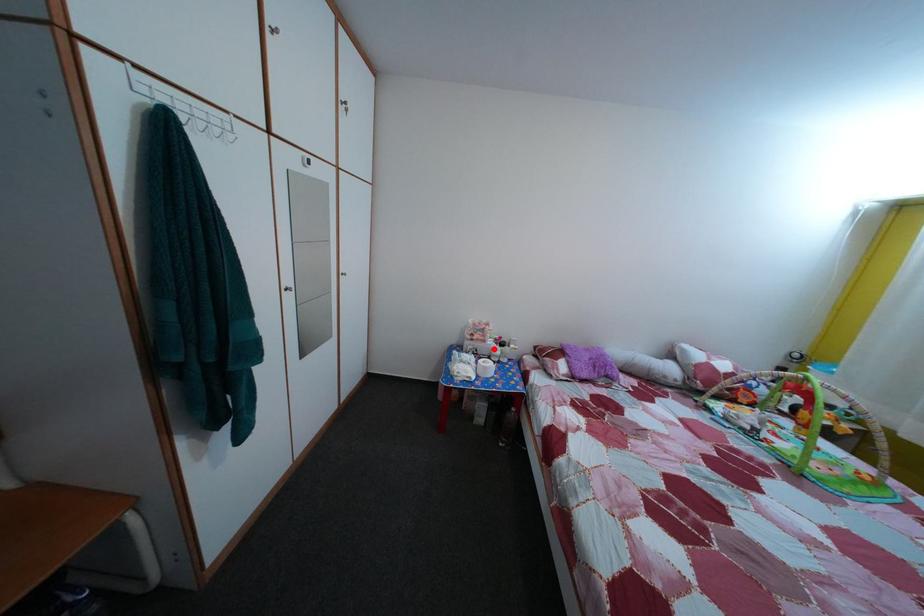
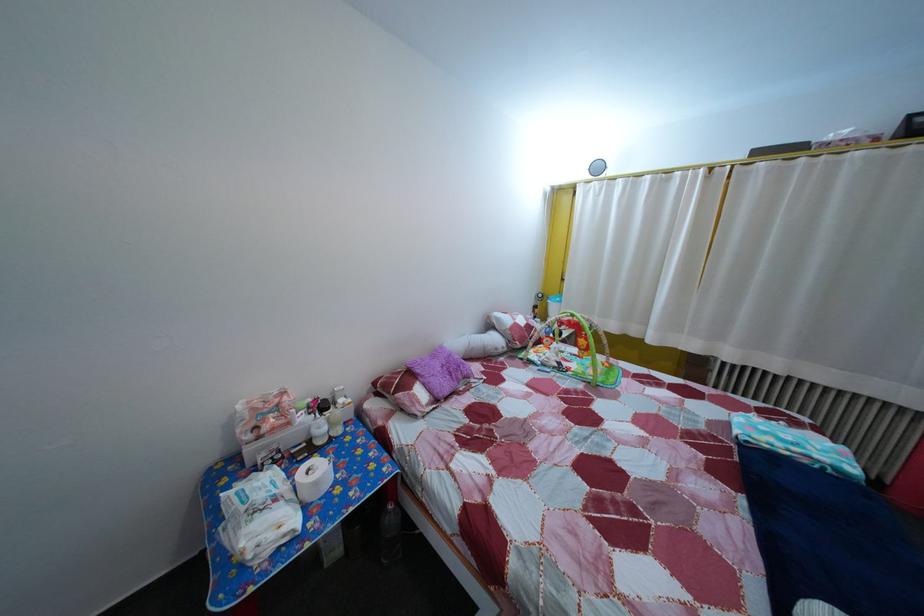
In the second image, find the point that corresponds to the highlighted location in the first image.

(298, 432)